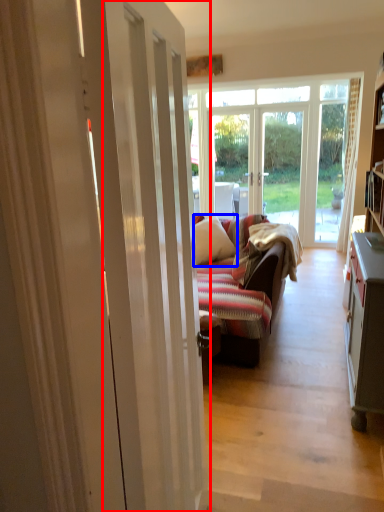
Question: Among these objects, which one is nearest to the camera, door (highlighted by a red box) or pillow (highlighted by a blue box)?

Choices:
 (A) door
 (B) pillow

Answer: (A)